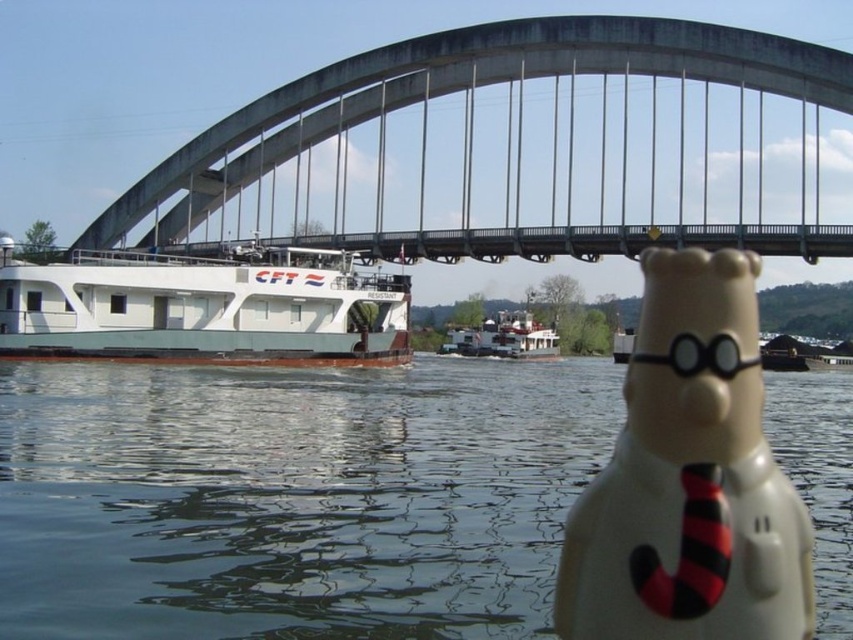
You are a photographer wanting to capture the white matte barge at left and the transparent water at center in the same frame. Given their sizes, which object should you focus on to ensure both fit in the photo?

Since the transparent water at center is larger in size than the white matte barge at left, you should focus on the transparent water at center to ensure both objects fit in the photo.

You are standing at the edge of the river and see the transparent water at center and the white plastic figurine at center. Which object is positioned to the left?

The transparent water at center is to the left of the white plastic figurine at center.

Based on the photo, you are a photographer standing at the riverbank. You want to capture a photo where the transparent water at center and the white plastic figurine at center are both visible. Which object will appear smaller in the photo?

The transparent water at center will appear smaller in the photo because it occupies less space than the white plastic figurine at center.